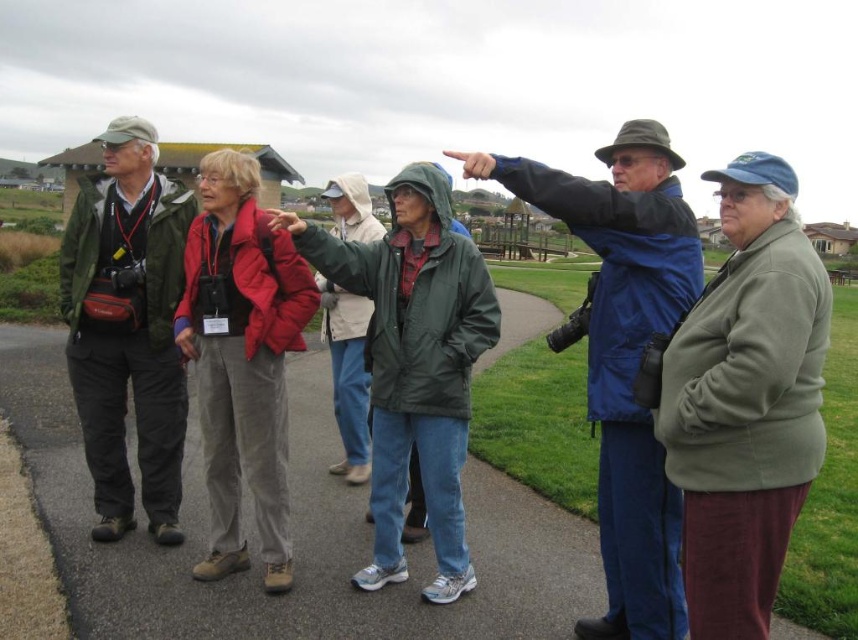
You are a photographer trying to capture a group photo of the five people in the scene. You need to ensure that both the green fabric jacket at left and the red corduroy pants at center are clearly visible in the frame. Based on their heights, which object should you focus on first to ensure proper focus?

The green fabric jacket at left is taller than the red corduroy pants at center. Since taller objects are often positioned at the back in group photos, focusing on the green fabric jacket at left first would help ensure proper focus on the entire group.

You are standing at point [143,227] in the image. You want to take a photo of the camera. Can you reach the camera without moving from your current position?

The distance between point [143,227] and the camera is 30.10 feet, so you cannot reach the camera without moving from your current position.